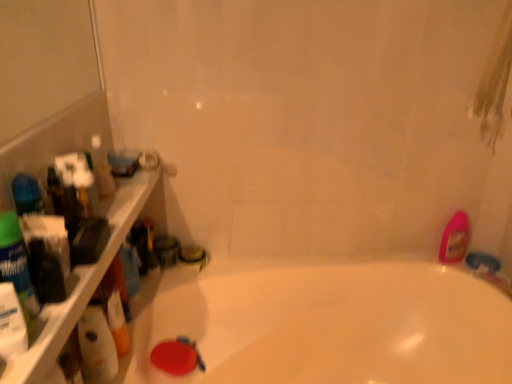
Question: Looking at their shapes, would you say translucent plastic bottles at left is wider or thinner than white glossy bathtub at center?

Choices:
 (A) wide
 (B) thin

Answer: (B)

Question: Is translucent plastic bottles at left taller or shorter than white glossy bathtub at center?

Choices:
 (A) short
 (B) tall

Answer: (A)

Question: Which object is positioned closest to the white glossy bathtub at center?

Choices:
 (A) white glossy bottle at left
 (B) translucent plastic bottles at left
 (C) pink glossy bottle at right

Answer: (C)

Question: Which is farther from the translucent plastic bottles at left?

Choices:
 (A) white glossy bathtub at center
 (B) pink glossy bottle at right
 (C) white glossy bottle at left

Answer: (B)